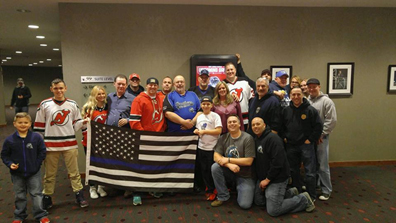
You are a GUI agent. You are given a task and a screenshot of the screen. Output one action in this format:
    pyautogui.click(x=<x>, y=<y>)
    Task: Click on the ceiling
    The width and height of the screenshot is (396, 223).
    Given the screenshot: What is the action you would take?
    pyautogui.click(x=317, y=2)